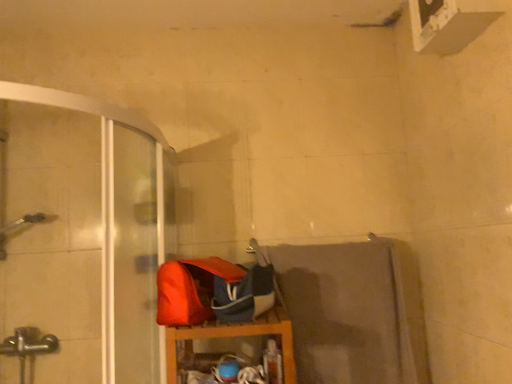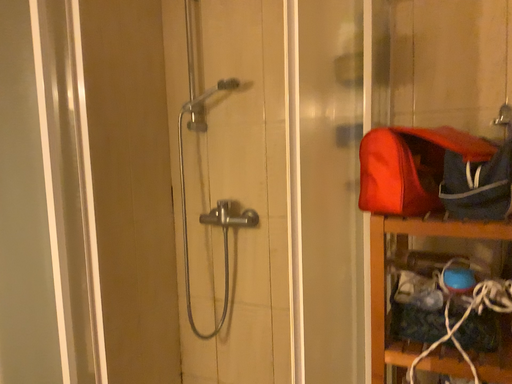
Question: How did the camera likely rotate when shooting the video?

Choices:
 (A) rotated left
 (B) rotated right

Answer: (A)